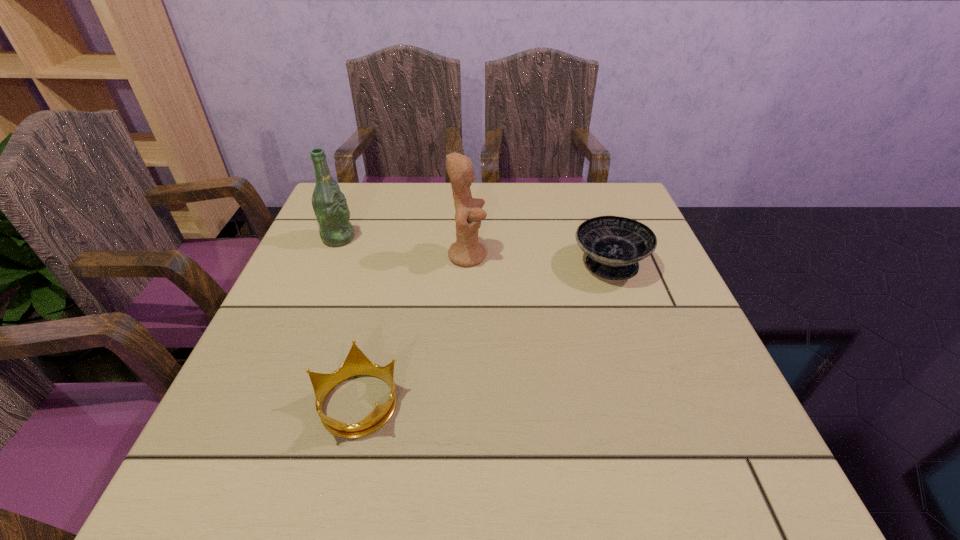
Find the location of a particular element. vacant space that is in between the bowl and the second object from left to right is located at coordinates (484, 334).

At what (x,y) coordinates should I click in order to perform the action: click on empty space between the beer bottle and the second object from right to left. Please return your answer as a coordinate pair (x, y). The width and height of the screenshot is (960, 540). Looking at the image, I should click on (403, 247).

Where is `vacant area that lies between the figurine and the beer bottle`? The width and height of the screenshot is (960, 540). vacant area that lies between the figurine and the beer bottle is located at coordinates (403, 247).

The image size is (960, 540). In order to click on free space between the figurine and the second object from left to right in this screenshot , I will do `click(413, 329)`.

This screenshot has width=960, height=540. What are the coordinates of `vacant area between the second object from right to left and the nearest object` in the screenshot? It's located at (413, 329).

Identify the location of the closest object to the rightmost object. This screenshot has height=540, width=960. (466, 251).

Locate an element on the screen. This screenshot has height=540, width=960. object that can be found as the closest to the bowl is located at coordinates (466, 251).

I want to click on vacant point that satisfies the following two spatial constraints: 1. on the surface of the leftmost object; 2. on the back side of the second object from left to right, so click(x=272, y=402).

At what (x,y) coordinates should I click in order to perform the action: click on vacant area in the image that satisfies the following two spatial constraints: 1. on the front-facing side of the second object from right to left; 2. on the back side of the rightmost object. Please return your answer as a coordinate pair (x, y). Looking at the image, I should click on (468, 265).

The height and width of the screenshot is (540, 960). Identify the location of free space that satisfies the following two spatial constraints: 1. on the surface of the beer bottle; 2. on the back side of the crown. (272, 402).